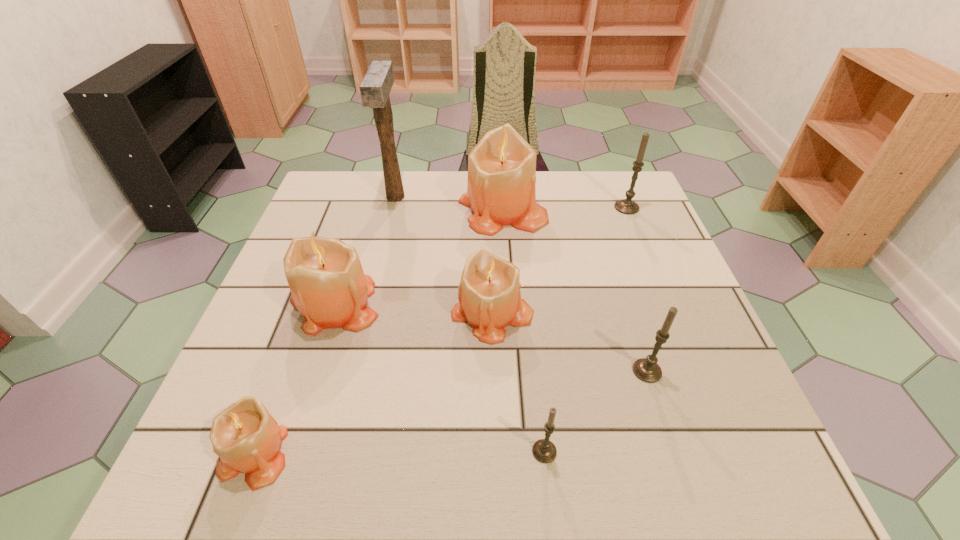
The width and height of the screenshot is (960, 540). I want to click on mallet, so click(x=375, y=88).

At what (x,y) coordinates should I click in order to perform the action: click on the biggest beige candle. Please return your answer as a coordinate pair (x, y). Looking at the image, I should click on (501, 191).

The image size is (960, 540). In order to click on the rightmost object in this screenshot , I will do `click(626, 206)`.

You are a GUI agent. You are given a task and a screenshot of the screen. Output one action in this format:
    pyautogui.click(x=<x>, y=<y>)
    Task: Click on the farthest gray candle
    The image size is (960, 540).
    Given the screenshot: What is the action you would take?
    pyautogui.click(x=626, y=206)

At what (x,y) coordinates should I click in order to perform the action: click on the second biggest beige candle. Please return your answer as a coordinate pair (x, y). Looking at the image, I should click on (329, 288).

I want to click on the sixth farthest object, so click(646, 369).

Identify the location of the second farthest gray candle. (646, 369).

The height and width of the screenshot is (540, 960). In order to click on the third biggest beige candle in this screenshot , I will do `click(489, 295)`.

Where is `the nearest gray candle`? The width and height of the screenshot is (960, 540). the nearest gray candle is located at coordinates (543, 450).

The width and height of the screenshot is (960, 540). I want to click on the leftmost gray candle, so click(x=543, y=450).